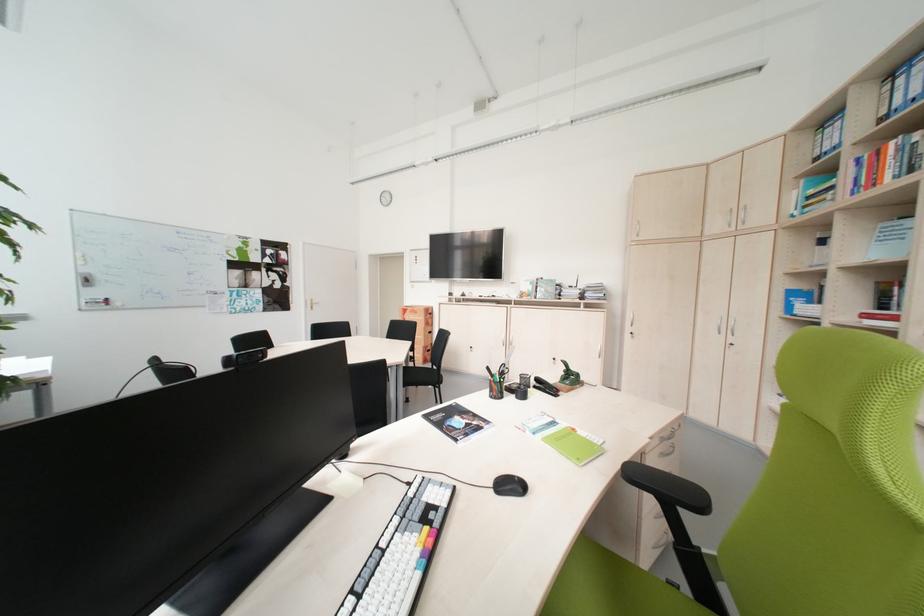
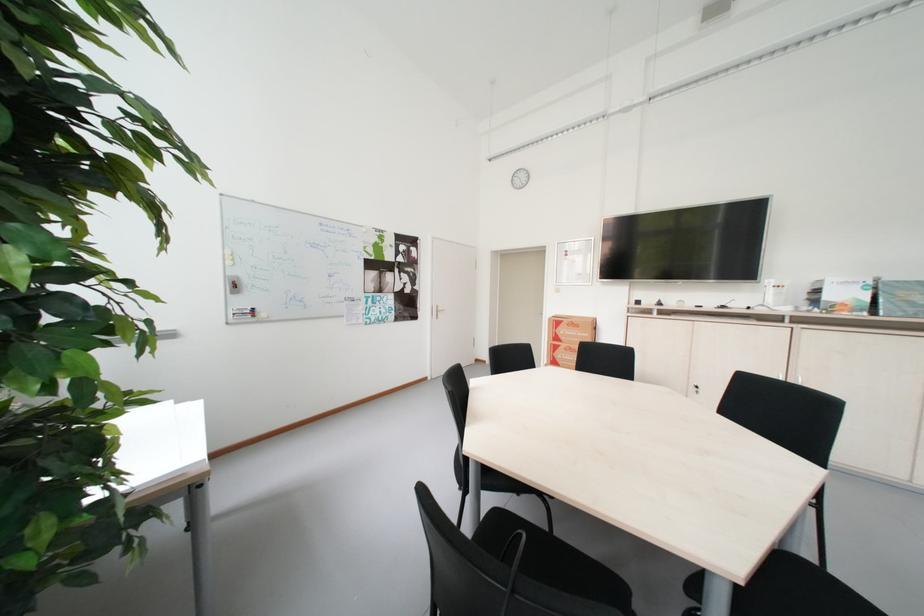
Find the pixel in the second image that matches (x=307, y=299) in the first image.

(434, 305)